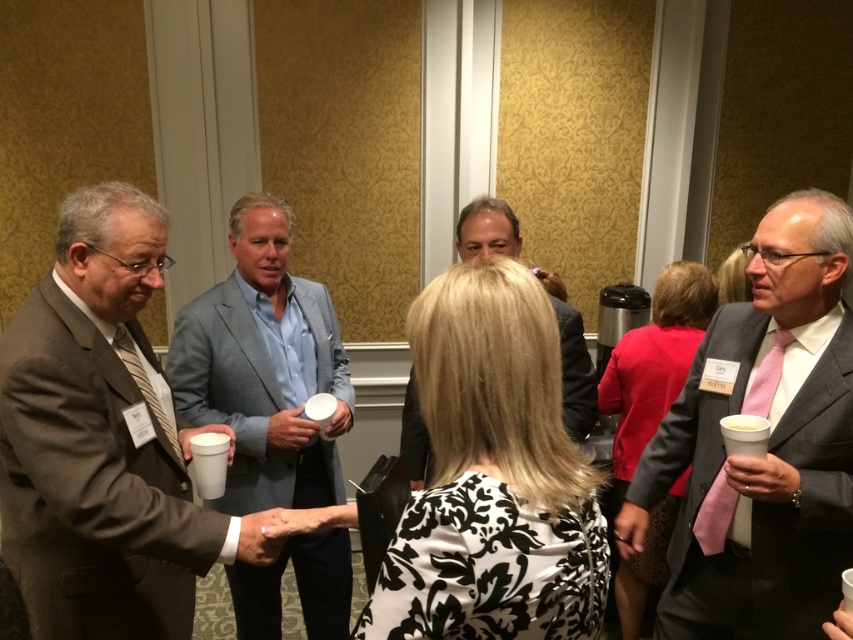
Question: Which object is closer to the camera taking this photo?

Choices:
 (A) matte gray suit at center
 (B) brown wool suit at left
 (C) white styrofoam cup at lower left

Answer: (B)

Question: Is brown wool suit at left smaller than white styrofoam cup at lower left?

Choices:
 (A) yes
 (B) no

Answer: (B)

Question: Is brown wool suit at left to the right of white styrofoam cup at lower left from the viewer's perspective?

Choices:
 (A) no
 (B) yes

Answer: (A)

Question: Based on their relative distances, which object is nearer to the light blue textured blazer at center?

Choices:
 (A) matte gray suit at right
 (B) white styrofoam cup at lower left
 (C) brown wool suit at left
 (D) matte gray suit at center

Answer: (B)

Question: Does matte gray suit at right appear on the right side of matte gray suit at center?

Choices:
 (A) yes
 (B) no

Answer: (A)

Question: Considering the real-world distances, which object is farthest from the matte gray suit at right?

Choices:
 (A) white styrofoam cup at lower left
 (B) matte gray suit at center

Answer: (A)